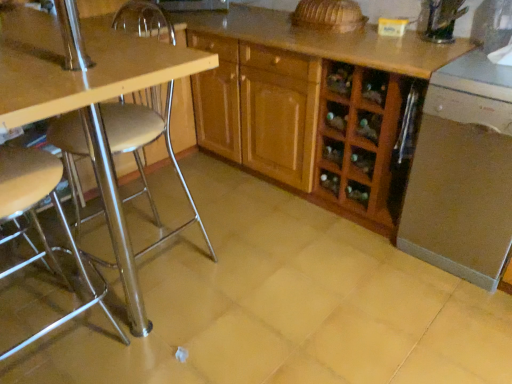
Question: Relative to metallic silver stool at left, is wooden cabinet at center in front or behind?

Choices:
 (A) behind
 (B) front

Answer: (A)

Question: From their relative heights in the image, would you say wooden cabinet at center is taller or shorter than metallic silver stool at left?

Choices:
 (A) short
 (B) tall

Answer: (A)

Question: Estimate the real-world distances between objects in this image. Which object is farther from the metallic silver stool at left?

Choices:
 (A) metallic silver stool at left
 (B) wooden cabinet at center
 (C) wooden table at left
 (D) satin silver dishwasher at lower right

Answer: (D)

Question: Estimate the real-world distances between objects in this image. Which object is farther from the wooden table at left?

Choices:
 (A) satin silver dishwasher at lower right
 (B) metallic silver stool at left
 (C) wooden cabinet at center
 (D) metallic silver stool at left

Answer: (A)